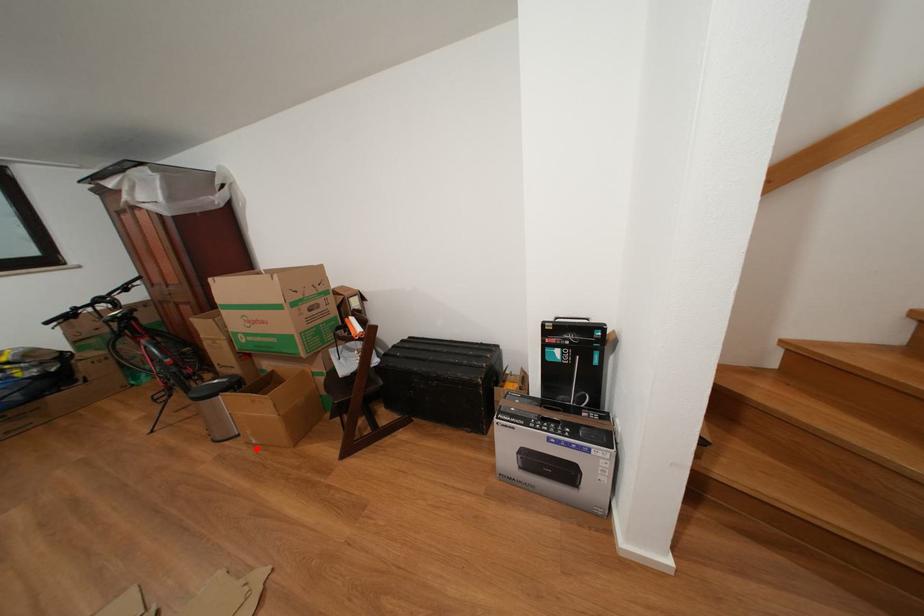
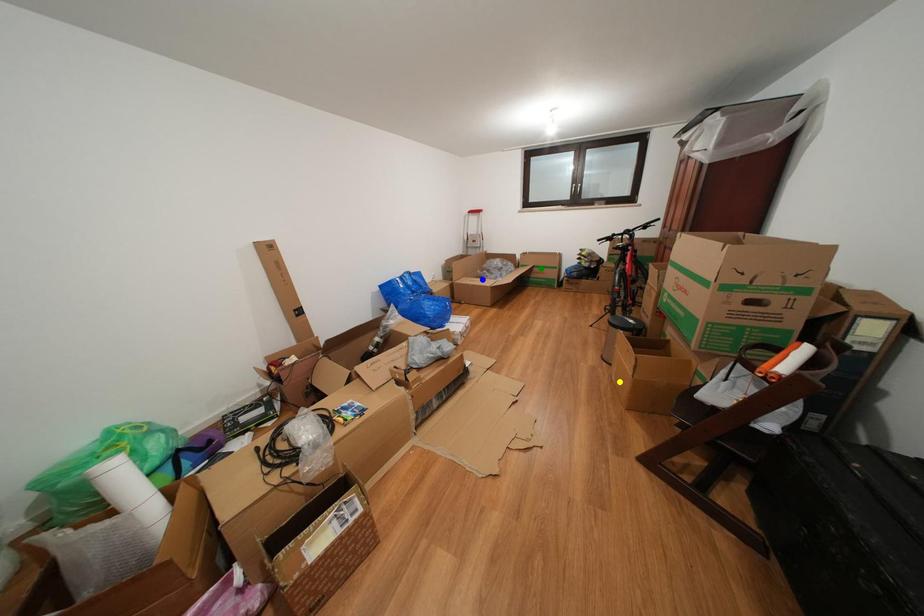
Question: I am providing you with two images of the same scene from different viewpoints. A red point is marked on the first image. You are given multiple points on the second image. Which mark in image 2 goes with the point in image 1?

Choices:
 (A) green point
 (B) blue point
 (C) yellow point

Answer: (C)